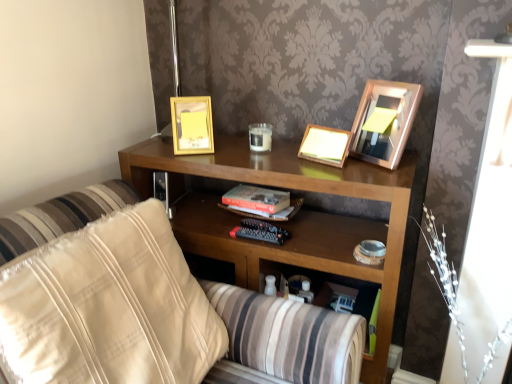
In order to click on vacant position to the left of gold metallic picture frame at upper right, arranged as the 3th picture frame when viewed from the left in this screenshot , I will do `click(317, 168)`.